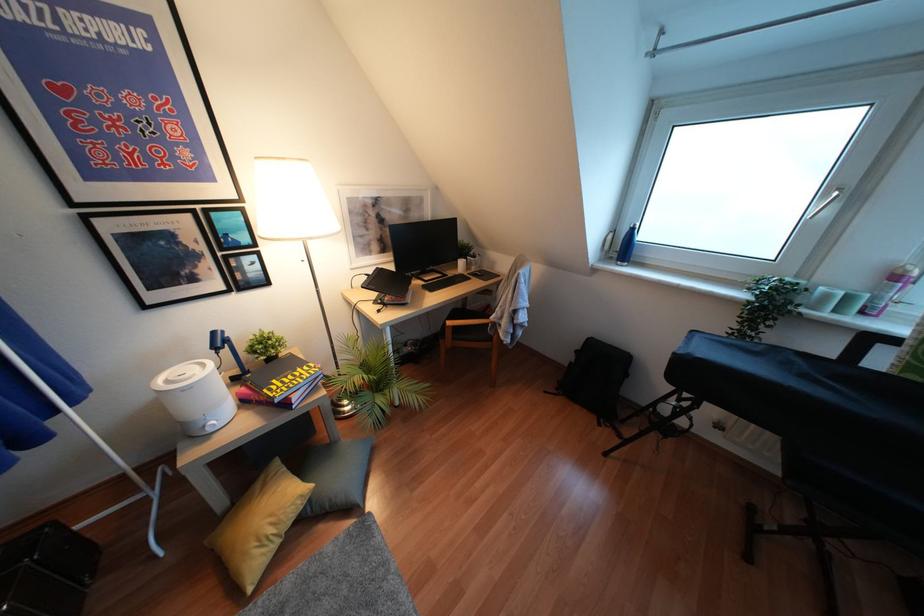
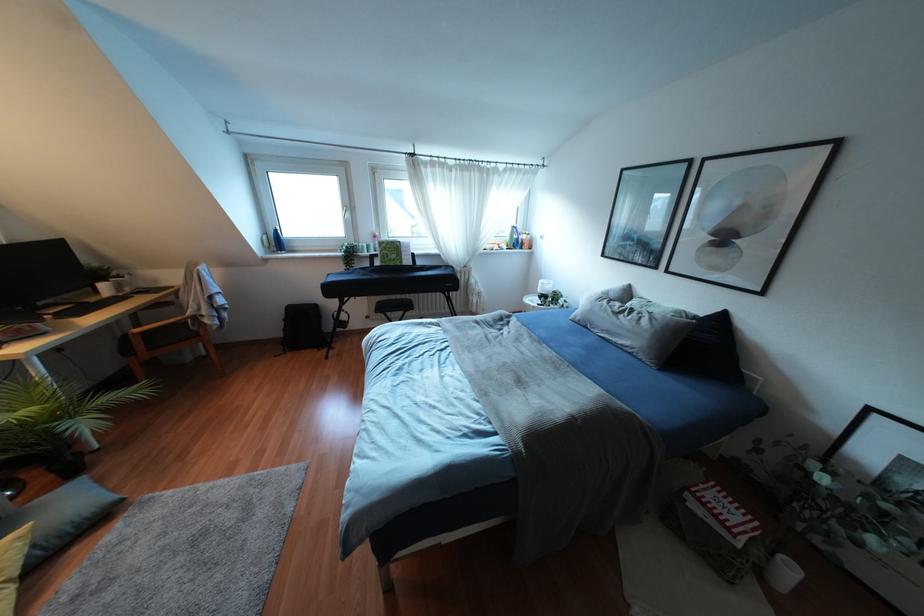
The point at (829, 212) is marked in the first image. Where is the corresponding point in the second image?

(346, 215)